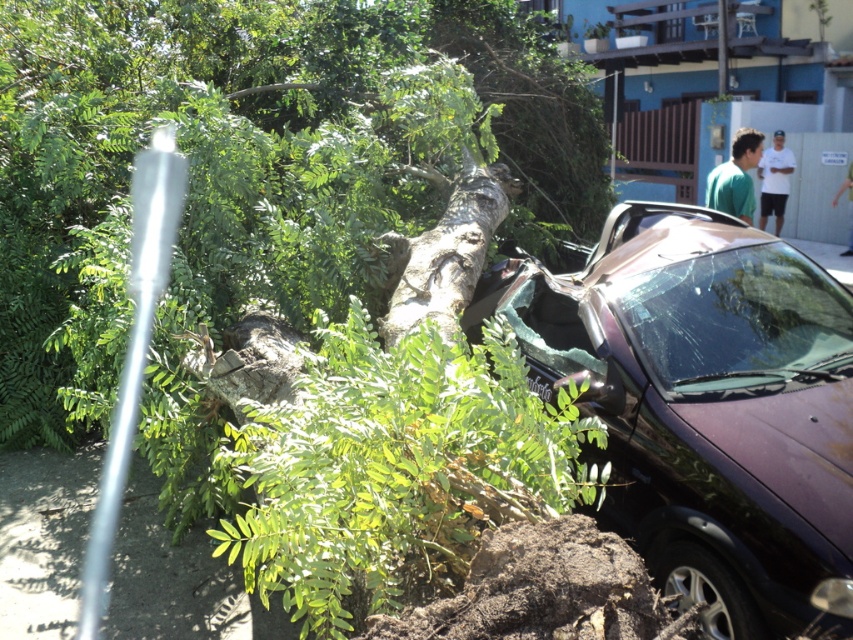
From the picture: Who is positioned more to the left, green matte shirt at upper right or white cotton shirt at upper right?

green matte shirt at upper right

Does green matte shirt at upper right have a lesser width compared to white cotton shirt at upper right?

Correct, green matte shirt at upper right's width is less than white cotton shirt at upper right's.

The height and width of the screenshot is (640, 853). In order to click on green matte shirt at upper right in this screenshot , I will do `click(735, 177)`.

In the scene shown: Which of these two, metallic purple car at center or green matte shirt at upper right, stands shorter?

green matte shirt at upper right is shorter.

Which is above, metallic purple car at center or green matte shirt at upper right?

green matte shirt at upper right is higher up.

Which is behind, point (788, 595) or point (727, 188)?

The point (727, 188) is behind.

I want to click on metallic purple car at center, so click(701, 403).

Between point (511, 115) and point (778, 186), which one is positioned behind?

Positioned behind is point (778, 186).

I want to click on green leafy tree trunk at center, so click(251, 180).